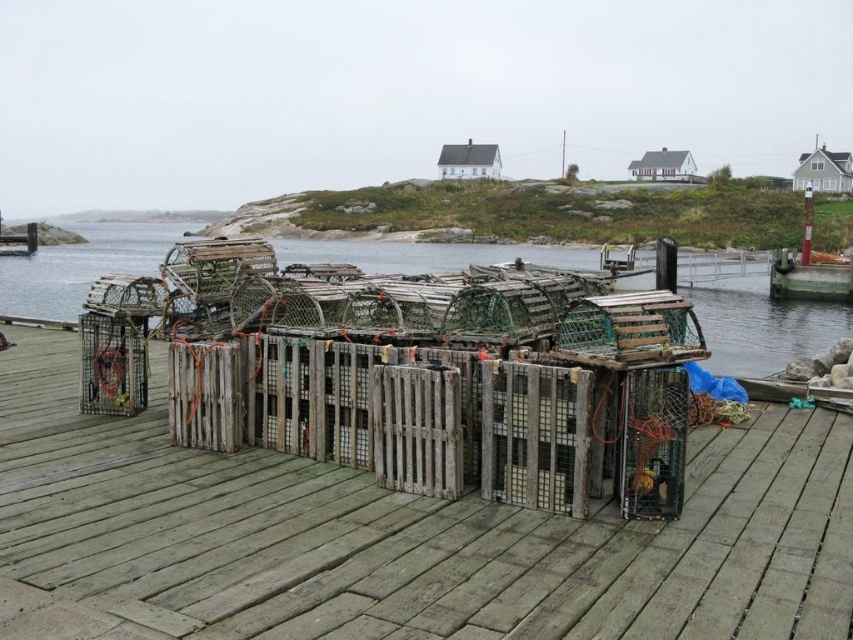
Can you confirm if wooden crates at center is taller than wooden dock at lower right?

Yes, wooden crates at center is taller than wooden dock at lower right.

Between wooden crates at center and wooden dock at lower right, which one is positioned lower?

Positioned lower is wooden dock at lower right.

Is point (756, 340) closer to viewer compared to point (770, 280)?

Yes, point (756, 340) is closer to viewer.

Find the location of a particular element. This screenshot has height=640, width=853. wooden crates at center is located at coordinates (761, 324).

Between point (181, 502) and point (59, 307), which one is positioned behind?

The point (59, 307) is more distant.

Between weathered wood crates at center and wooden crates at center, which one appears on the right side from the viewer's perspective?

Positioned to the right is weathered wood crates at center.

What do you see at coordinates (397, 536) in the screenshot?
I see `weathered wood crates at center` at bounding box center [397, 536].

The image size is (853, 640). Find the location of `weathered wood crates at center`. weathered wood crates at center is located at coordinates (397, 536).

Between weathered wood crates at center and wooden dock at lower right, which one appears on the right side from the viewer's perspective?

wooden dock at lower right is more to the right.

Does weathered wood crates at center appear on the left side of wooden dock at lower right?

Indeed, weathered wood crates at center is positioned on the left side of wooden dock at lower right.

Is point (780, 458) positioned after point (807, 244)?

That is False.

Where is `weathered wood crates at center`? The height and width of the screenshot is (640, 853). weathered wood crates at center is located at coordinates (397, 536).